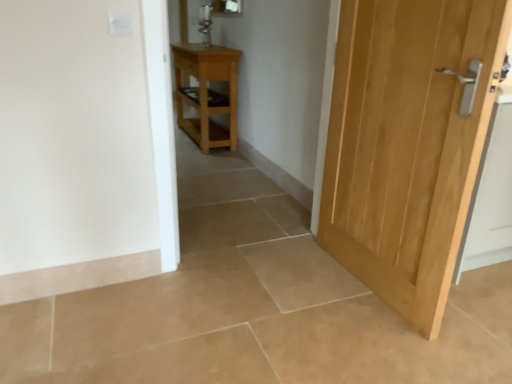
This screenshot has height=384, width=512. What are the coordinates of `natural wood door at right` in the screenshot? It's located at (407, 143).

Image resolution: width=512 pixels, height=384 pixels. Describe the element at coordinates (407, 143) in the screenshot. I see `natural wood door at right` at that location.

In order to face light brown wood nightstand at center, should I rotate leftwards or rightwards?

Turn left by 7.263 degrees to look at light brown wood nightstand at center.

Describe the element at coordinates (207, 93) in the screenshot. I see `light brown wood nightstand at center` at that location.

Locate an element on the screen. The width and height of the screenshot is (512, 384). light brown wood nightstand at center is located at coordinates (207, 93).

I want to click on natural wood door at right, so click(407, 143).

Can you confirm if light brown wood nightstand at center is positioned to the left of natural wood door at right?

Indeed, light brown wood nightstand at center is positioned on the left side of natural wood door at right.

Which object is further away from the camera, light brown wood nightstand at center or natural wood door at right?

light brown wood nightstand at center is further from the camera.

Does point (205, 92) appear closer or farther from the camera than point (356, 35)?

Point (205, 92) is positioned farther from the camera compared to point (356, 35).

From the image's perspective, is light brown wood nightstand at center on top of natural wood door at right?

Indeed, from the image's perspective, light brown wood nightstand at center is shown above natural wood door at right.

From a real-world perspective, is light brown wood nightstand at center positioned above or below natural wood door at right?

light brown wood nightstand at center is below natural wood door at right.

Is light brown wood nightstand at center thinner than natural wood door at right?

No, light brown wood nightstand at center is not thinner than natural wood door at right.

Is light brown wood nightstand at center taller than natural wood door at right?

Incorrect, the height of light brown wood nightstand at center is not larger of that of natural wood door at right.

Looking at this image, which of these two, light brown wood nightstand at center or natural wood door at right, is bigger?

Bigger between the two is light brown wood nightstand at center.

In the scene shown: Would you say light brown wood nightstand at center is inside or outside natural wood door at right?

light brown wood nightstand at center is not enclosed by natural wood door at right.

Is light brown wood nightstand at center positioned far away from natural wood door at right?

Absolutely, light brown wood nightstand at center is distant from natural wood door at right.

Is light brown wood nightstand at center positioned with its back to natural wood door at right?

No, light brown wood nightstand at center's orientation is not away from natural wood door at right.

At what (x,y) coordinates should I click in order to perform the action: click on nightstand behind the natural wood door at right. Please return your answer as a coordinate pair (x, y). This screenshot has height=384, width=512. Looking at the image, I should click on (207, 93).

Between natural wood door at right and light brown wood nightstand at center, which one appears on the left side from the viewer's perspective?

light brown wood nightstand at center.

Considering their positions, is natural wood door at right located in front of or behind light brown wood nightstand at center?

Visually, natural wood door at right is located in front of light brown wood nightstand at center.

Does point (446, 221) come in front of point (232, 80)?

Yes, point (446, 221) is closer to viewer.

From the image's perspective, would you say natural wood door at right is shown under light brown wood nightstand at center?

Correct, natural wood door at right appears lower than light brown wood nightstand at center in the image.

From a real-world perspective, which is physically below, natural wood door at right or light brown wood nightstand at center?

light brown wood nightstand at center, from a real-world perspective.

Looking at their sizes, would you say natural wood door at right is wider or thinner than light brown wood nightstand at center?

natural wood door at right is thinner than light brown wood nightstand at center.

Considering the sizes of objects natural wood door at right and light brown wood nightstand at center in the image provided, who is taller, natural wood door at right or light brown wood nightstand at center?

With more height is natural wood door at right.

Between natural wood door at right and light brown wood nightstand at center, which one has smaller size?

With smaller size is natural wood door at right.

Choose the correct answer: Is natural wood door at right inside light brown wood nightstand at center or outside it?

natural wood door at right is outside light brown wood nightstand at center.

Looking at this image, is natural wood door at right placed right next to light brown wood nightstand at center?

No.

Looking at this image, is natural wood door at right oriented towards light brown wood nightstand at center?

No, natural wood door at right is not turned towards light brown wood nightstand at center.

How different are the orientations of natural wood door at right and light brown wood nightstand at center in degrees?

The angular difference between natural wood door at right and light brown wood nightstand at center is 0.58 degrees.

In order to click on nightstand lying on the left of natural wood door at right in this screenshot , I will do `click(207, 93)`.

Where is `door above the light brown wood nightstand at center (from a real-world perspective)`? This screenshot has height=384, width=512. door above the light brown wood nightstand at center (from a real-world perspective) is located at coordinates (407, 143).

You are a GUI agent. You are given a task and a screenshot of the screen. Output one action in this format:
    pyautogui.click(x=<x>, y=<y>)
    Task: Click on the nightstand on the left of natural wood door at right
    
    Given the screenshot: What is the action you would take?
    pyautogui.click(x=207, y=93)